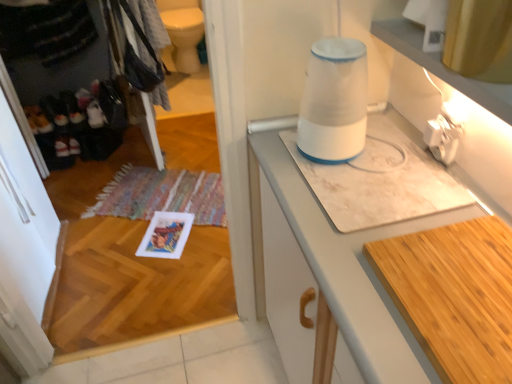
Question: From their relative heights in the image, would you say multicolored woven mat at lower left is taller or shorter than white marble countertop at center?

Choices:
 (A) tall
 (B) short

Answer: (B)

Question: Which is correct: multicolored woven mat at lower left is inside white marble countertop at center, or outside of it?

Choices:
 (A) inside
 (B) outside

Answer: (B)

Question: Which object is positioned closest to the wooden cutting board at lower right?

Choices:
 (A) multicolored woven mat at lower left
 (B) white marble countertop at center
 (C) white plastic blender at upper center

Answer: (B)

Question: Considering the real-world distances, which object is farthest from the multicolored woven mat at lower left?

Choices:
 (A) white marble countertop at center
 (B) wooden cutting board at lower right
 (C) white plastic blender at upper center

Answer: (B)